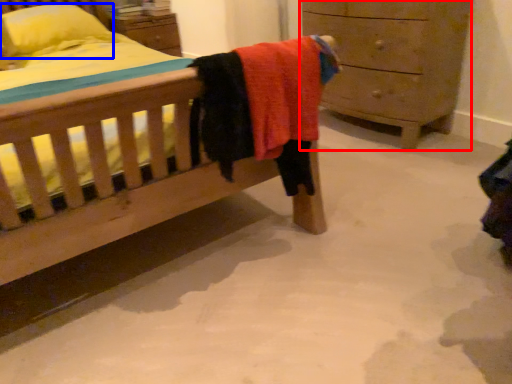
Question: Which point is closer to the camera, chest of drawers (highlighted by a red box) or pillow (highlighted by a blue box)?

Choices:
 (A) chest of drawers
 (B) pillow

Answer: (A)